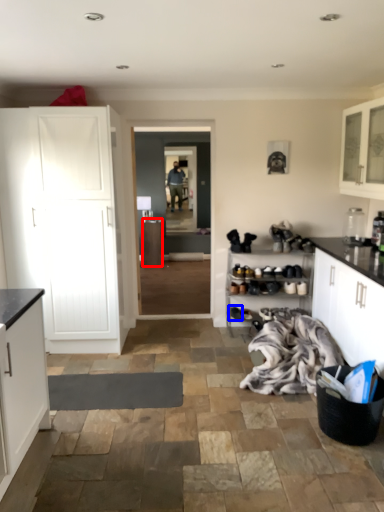
Question: Which of the following is the farthest to the observer, cabinetry (highlighted by a red box) or footwear (highlighted by a blue box)?

Choices:
 (A) cabinetry
 (B) footwear

Answer: (A)